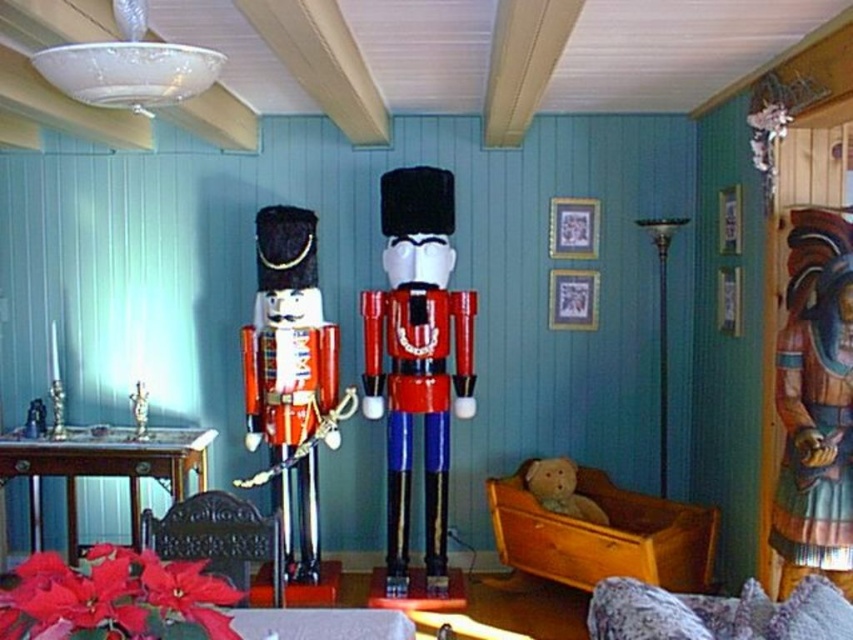
Question: Which of the following is the closest to the observer?

Choices:
 (A) glossy painted wood nutcracker at center
 (B) wooden carved figure at right
 (C) fluffy brown teddy bear at lower center

Answer: (B)

Question: Is the position of wooden polished table at lower left less distant than that of fluffy brown teddy bear at lower center?

Choices:
 (A) yes
 (B) no

Answer: (A)

Question: Is shiny red wood nutcracker at left to the right of metallic silver candlestick at left from the viewer's perspective?

Choices:
 (A) yes
 (B) no

Answer: (A)

Question: Which object is the closest to the wooden polished table at lower left?

Choices:
 (A) glossy painted wood nutcracker at center
 (B) wooden totem pole at right
 (C) black wrought iron bed at lower left
 (D) smooth wooden table at center

Answer: (A)

Question: Which point appears farthest from the camera in this image?

Choices:
 (A) (149, 564)
 (B) (27, 426)
 (C) (67, 474)
 (D) (285, 630)

Answer: (B)

Question: Is floral fabric couch at lower right thinner than fluffy brown teddy bear at lower center?

Choices:
 (A) no
 (B) yes

Answer: (A)